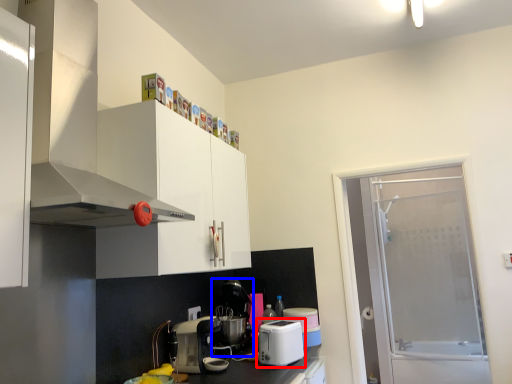
Question: Which object is further to the camera taking this photo, kitchen appliance (highlighted by a red box) or coffee machine (highlighted by a blue box)?

Choices:
 (A) kitchen appliance
 (B) coffee machine

Answer: (B)